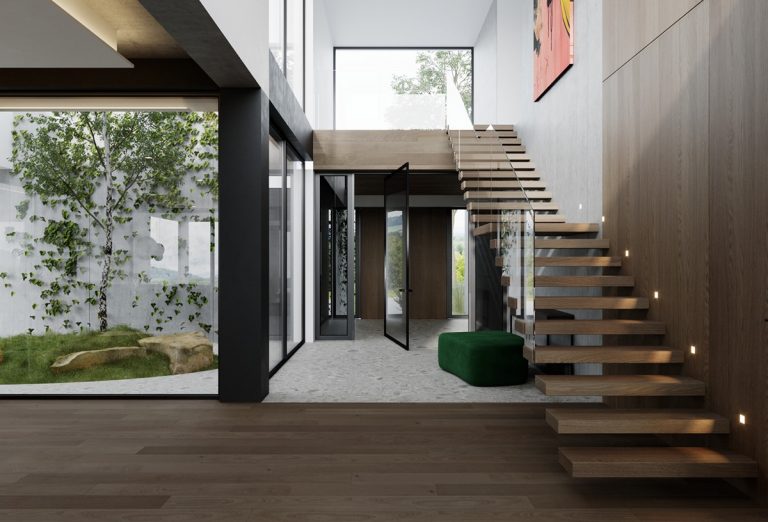
Identify the location of stairway. The image size is (768, 522). (634, 438).